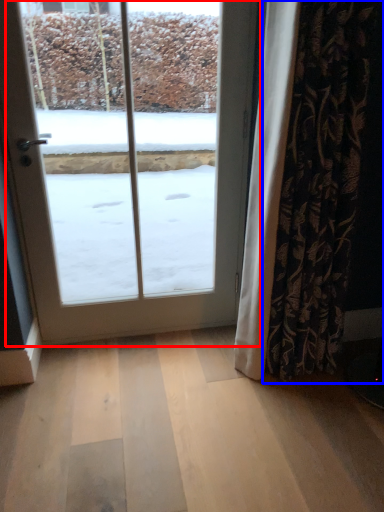
Question: Which object appears farthest to the camera in this image, door (highlighted by a red box) or curtain (highlighted by a blue box)?

Choices:
 (A) door
 (B) curtain

Answer: (A)